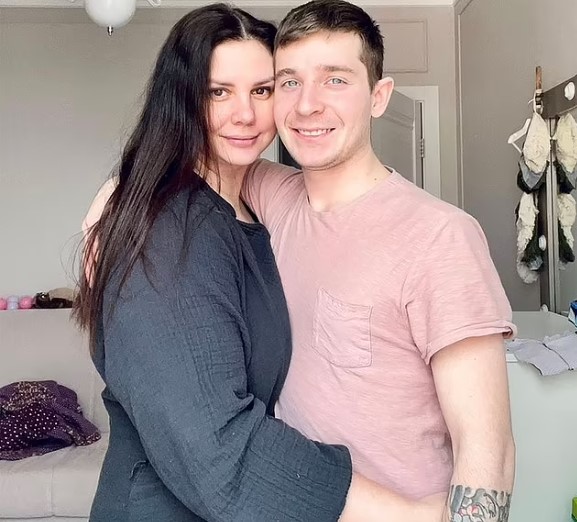
The height and width of the screenshot is (522, 577). Identify the location of white walls. (48, 118), (490, 102).